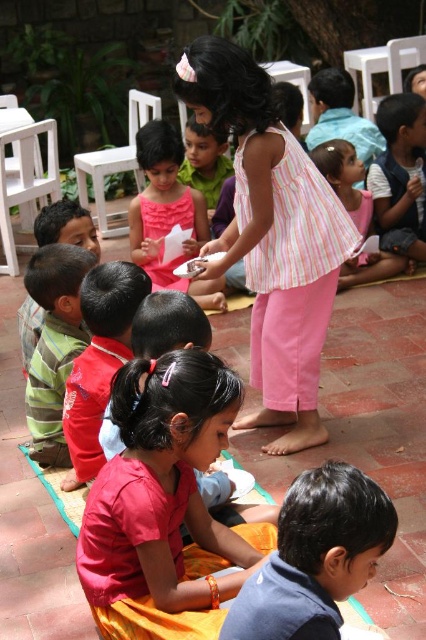
You are standing at the point marked as point (282,540) in the courtyard. If you want to take a photo of the entire group of children using a camera that has a maximum range of 2 meters, will you be able to capture them all in one shot?

The distance between point (282,540) and the camera is 2.11 meters, which exceeds the camera maximum range of 2 meters. Therefore, you won be able to capture them all in one shot.

You are standing at the center of the courtyard and want to locate the striped fabric dress at center. Which direction should you look to find it?

The striped fabric dress at center is located at point coordinates (271, 236), so you should look towards the lower right direction from the center to find it.

You are a photographer trying to capture the striped fabric dress at center in your shot. You want to position your camera so that the dress is exactly at the center of the image. Given that the dress is currently located at coordinates 0.370 on the x axis and 0.638 on the y axis, how much do you need to adjust the camera horizontally and vertically to center it?

To center the striped fabric dress at center, you need to move the camera horizontally by subtracting 0.370 from the x coordinate and vertically by subtracting 0.638 from the y coordinate so that the dress is positioned at the center point of the image.